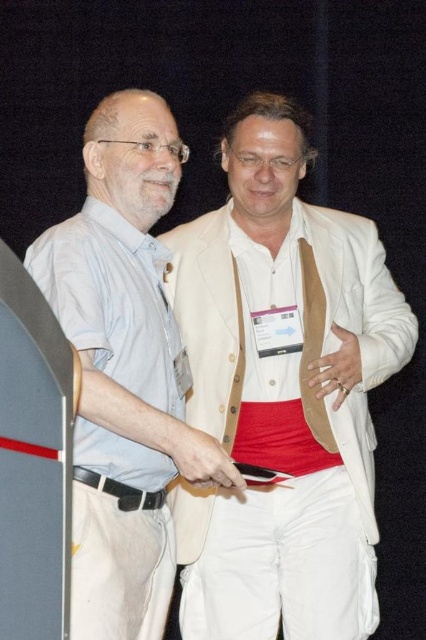
You are a photographer setting up for a group photo. You need to position yourself so that both the white cotton blazer at center and the matte light blue shirt at left are in focus. Which person should you focus on first to ensure both are sharp?

You should focus on the white cotton blazer at center first because it is closer to you than the matte light blue shirt at left, ensuring both will be in focus when focusing on the closer object first.

Consider the image. You are organizing a photo shoot and need to ensure that the white cotton blazer at center and the matte light blue shirt at left can fit side by side on a mannequin stand that is 1.2 meters wide. Based on the image, can both items fit without overlapping?

The white cotton blazer at center might be wider than matte light blue shirt at left, so it is uncertain if both can fit side by side on the 1.2 meters wide mannequin stand without overlapping. Further measurement is needed.

You are a photographer setting up for a group photo. You need to ensure that the matte light blue shirt at left and the black leather belt at lower left are both clearly visible in the frame. Given their sizes, which object might require you to adjust your camera angle to avoid being too dominant in the photo?

The matte light blue shirt at left is larger in size than the black leather belt at lower left, so the matte light blue shirt at left might require adjusting the camera angle to prevent it from dominating the frame.